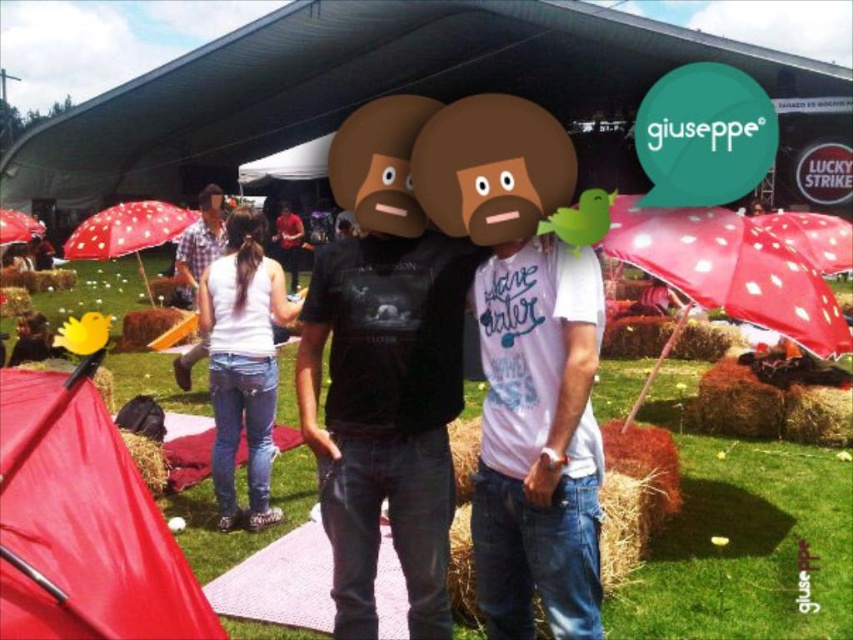
Please look at the image and locate the point at coordinates (83, 525). What object is located at this position?

The point at coordinates (83, 525) marks the red fabric canopy at lower left.

From the picture: You are at the outdoor event and want to take a photo under the red dotted umbrella at lower left. You also have a red shirt at center that you want to include in the shot. Since the umbrella is much taller than the shirt, where should you position yourself to ensure both are visible in the frame?

Position yourself closer to the red dotted umbrella at lower left so that its height doesn not overshadow the red shirt at center, ensuring both are visible in the photo.